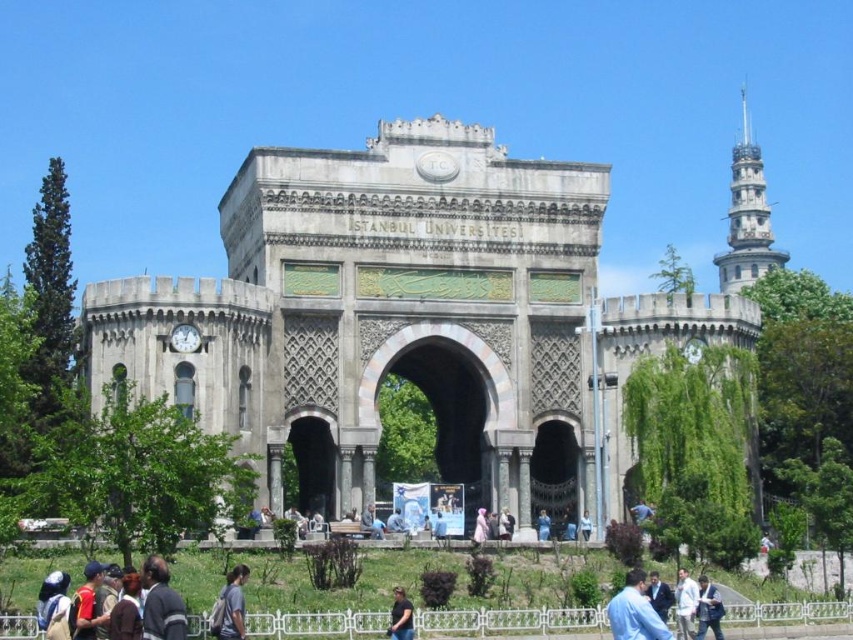
Is point (700, 614) farther from camera compared to point (648, 572)?

No.

The height and width of the screenshot is (640, 853). Describe the element at coordinates (708, 609) in the screenshot. I see `light blue shirt at center` at that location.

Image resolution: width=853 pixels, height=640 pixels. What are the coordinates of `light blue shirt at center` in the screenshot? It's located at tap(708, 609).

Is blue shirt at lower right taller than light brown leather jacket at center?

Yes.

What do you see at coordinates (635, 611) in the screenshot?
I see `blue shirt at lower right` at bounding box center [635, 611].

Find the location of a particular element. This screenshot has height=640, width=853. blue shirt at lower right is located at coordinates (635, 611).

Is dark blue shirt at lower center above light blue fabric at center?

Indeed, dark blue shirt at lower center is positioned over light blue fabric at center.

Where is `dark blue shirt at lower center`? The image size is (853, 640). dark blue shirt at lower center is located at coordinates (399, 616).